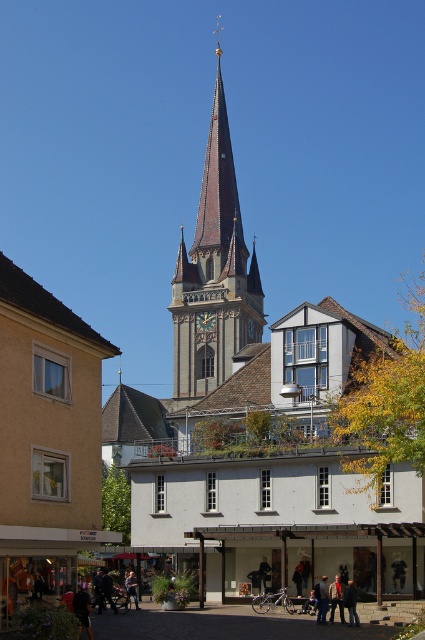
You are standing at the plaza and want to take a photo of the church steeple. There are two points marked in the scene. One is at point [195,330] and the other at point [135,605]. Which point should you stand at to ensure the church steeple is fully visible without any obstruction?

You should stand at point [135,605] because point [195,330] is behind it, so standing at the latter would block the view of the church steeple.